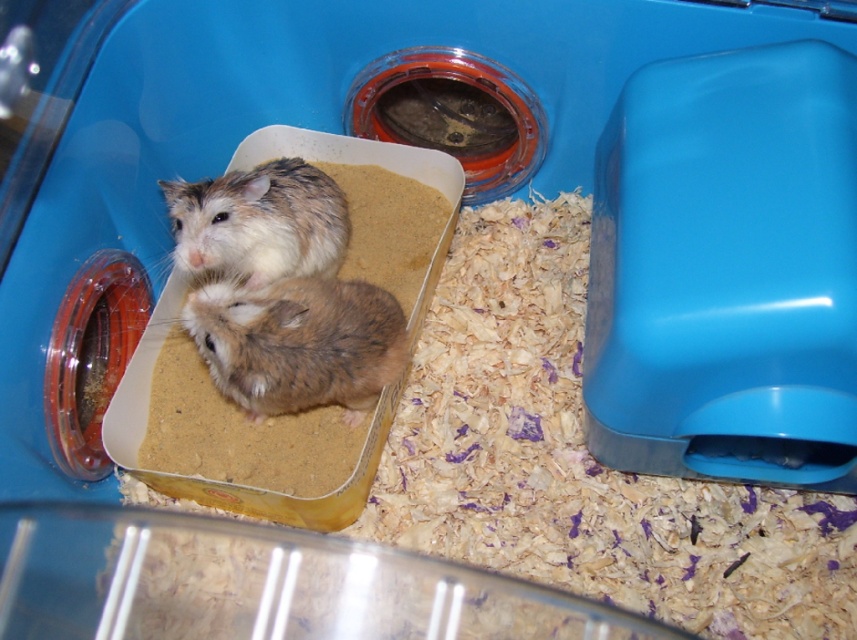
Question: Which of the following is the closest to the observer?

Choices:
 (A) (207, 300)
 (B) (309, 262)

Answer: (A)

Question: Is fuzzy brown mouse at center bigger than fuzzy brown hamster at center?

Choices:
 (A) no
 (B) yes

Answer: (B)

Question: Which point is closer to the camera?

Choices:
 (A) (232, 380)
 (B) (264, 244)

Answer: (A)

Question: Considering the relative positions of fuzzy brown mouse at center and fuzzy brown hamster at center in the image provided, where is fuzzy brown mouse at center located with respect to fuzzy brown hamster at center?

Choices:
 (A) right
 (B) left

Answer: (A)

Question: Does fuzzy brown mouse at center have a lesser width compared to fuzzy brown hamster at center?

Choices:
 (A) yes
 (B) no

Answer: (B)

Question: Among these points, which one is farthest from the camera?

Choices:
 (A) (345, 232)
 (B) (316, 285)

Answer: (A)